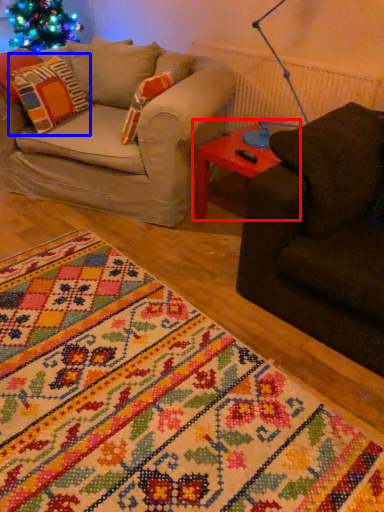
Question: Which of the following is the closest to the observer, table (highlighted by a red box) or pillow (highlighted by a blue box)?

Choices:
 (A) table
 (B) pillow

Answer: (A)